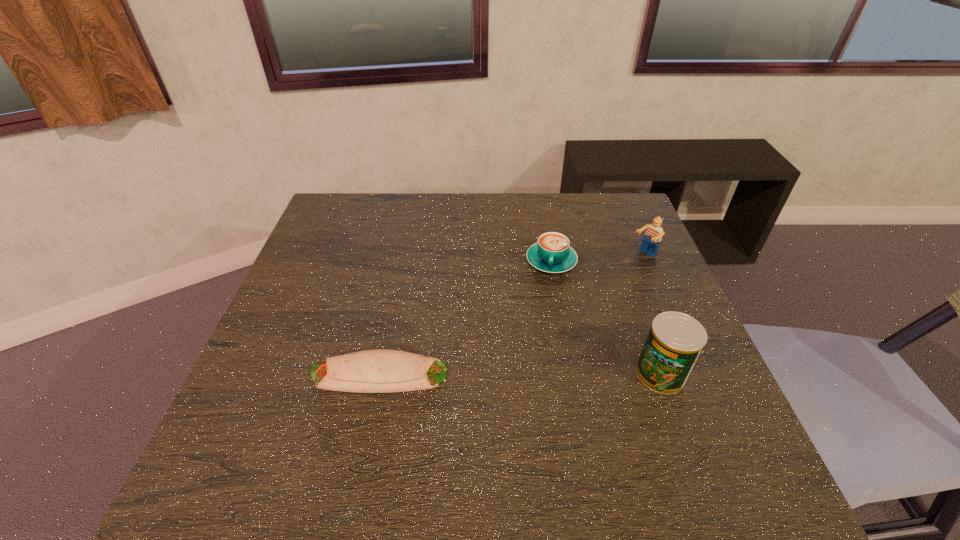
What are the coordinates of `vacant space on the desktop that is between the leftmost object and the can and is positioned with the handle on the right side of the cappuccino` in the screenshot? It's located at (534, 374).

Where is `vacant spot on the desktop that is between the burrito and the tallest object and is positioned on the face of the second tallest object`? vacant spot on the desktop that is between the burrito and the tallest object and is positioned on the face of the second tallest object is located at coordinates (488, 374).